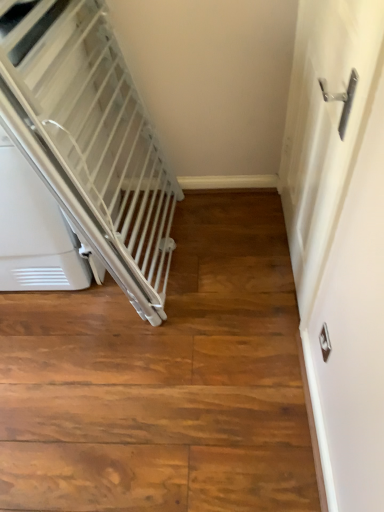
Question: Considering the relative sizes of white plastic escalator at left and white metallic door handle at right in the image provided, is white plastic escalator at left smaller than white metallic door handle at right?

Choices:
 (A) no
 (B) yes

Answer: (A)

Question: From a real-world perspective, is white plastic escalator at left positioned under white metallic door handle at right based on gravity?

Choices:
 (A) yes
 (B) no

Answer: (A)

Question: Is white plastic escalator at left facing towards white metallic door handle at right?

Choices:
 (A) yes
 (B) no

Answer: (B)

Question: Considering the relative sizes of white plastic escalator at left and white metallic door handle at right in the image provided, is white plastic escalator at left bigger than white metallic door handle at right?

Choices:
 (A) no
 (B) yes

Answer: (B)

Question: Is white plastic escalator at left positioned beyond the bounds of white metallic door handle at right?

Choices:
 (A) yes
 (B) no

Answer: (A)

Question: Can you confirm if white plastic escalator at left is taller than white metallic door handle at right?

Choices:
 (A) no
 (B) yes

Answer: (A)

Question: Is white metallic door handle at right taller than white plastic escalator at left?

Choices:
 (A) no
 (B) yes

Answer: (B)

Question: Does white metallic door handle at right come behind white plastic escalator at left?

Choices:
 (A) no
 (B) yes

Answer: (A)

Question: Is white metallic door handle at right thinner than white plastic escalator at left?

Choices:
 (A) no
 (B) yes

Answer: (B)

Question: From a real-world perspective, is white metallic door handle at right below white plastic escalator at left?

Choices:
 (A) no
 (B) yes

Answer: (A)

Question: Is white metallic door handle at right not near white plastic escalator at left?

Choices:
 (A) no
 (B) yes

Answer: (A)

Question: Is white metallic door handle at right oriented away from white plastic escalator at left?

Choices:
 (A) yes
 (B) no

Answer: (B)

Question: Considering their positions, is white metallic door handle at right located in front of or behind white plastic escalator at left?

Choices:
 (A) behind
 (B) front

Answer: (B)